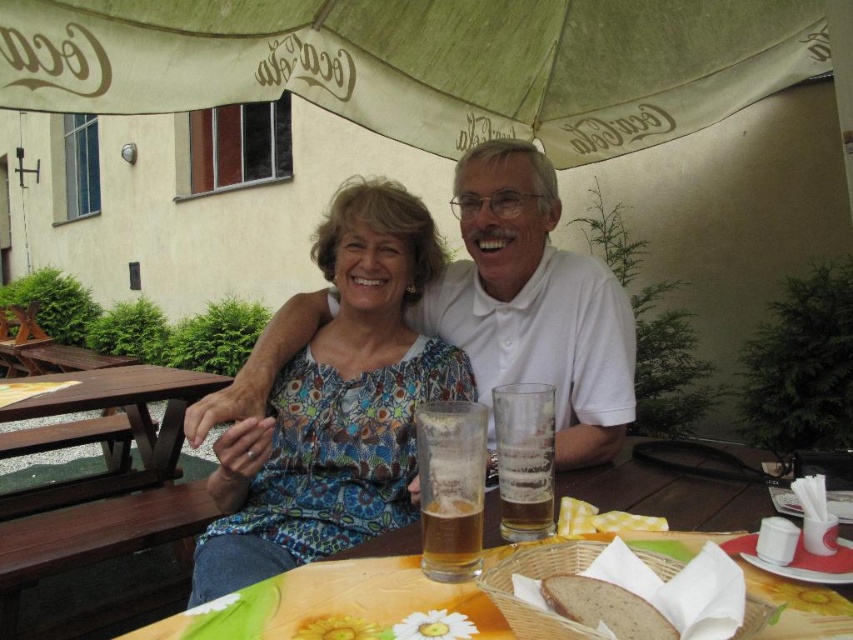
Question: Can you confirm if translucent glass at table center is thinner than brown matte bread at lower center?

Choices:
 (A) yes
 (B) no

Answer: (A)

Question: Can you confirm if wooden table at center is thinner than brown matte bread at lower center?

Choices:
 (A) yes
 (B) no

Answer: (B)

Question: Can you confirm if white matte shirt at center is thinner than brown matte bread at lower center?

Choices:
 (A) no
 (B) yes

Answer: (A)

Question: Which point is closer to the camera taking this photo?

Choices:
 (A) (148, 518)
 (B) (480, 500)
 (C) (515, 65)

Answer: (B)

Question: Which object appears farthest from the camera in this image?

Choices:
 (A) brown wood picnic table at lower left
 (B) floral fabric blouse at center
 (C) yellow checkered napkin at lower center
 (D) beige fabric umbrella at upper center

Answer: (A)

Question: Considering the real-world distances, which object is closest to the translucent glass beer at center?

Choices:
 (A) yellow checkered napkin at lower center
 (B) beige fabric umbrella at upper center
 (C) wooden table at center
 (D) floral fabric blouse at center

Answer: (A)